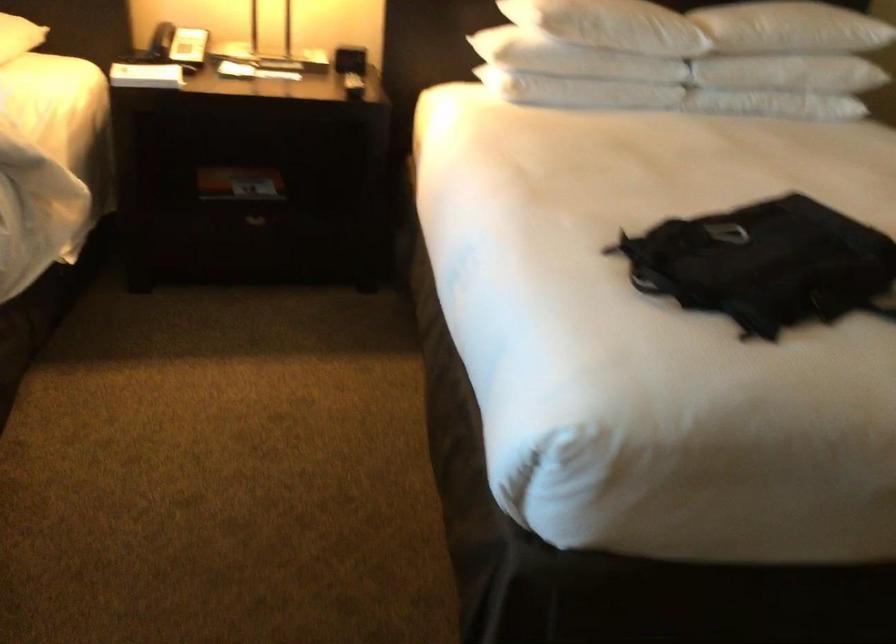
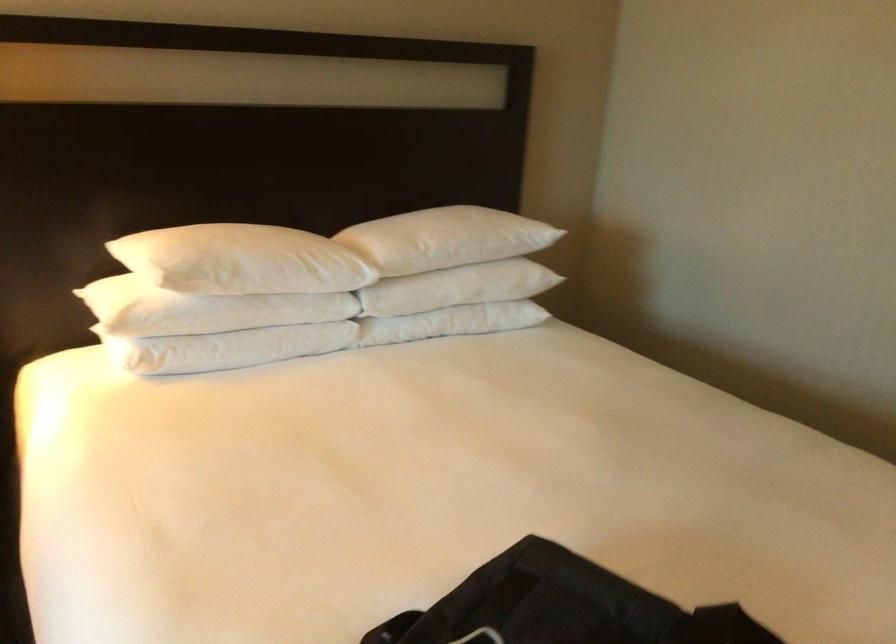
Locate, in the second image, the point that corresponds to the point at 726,230 in the first image.

(480, 637)